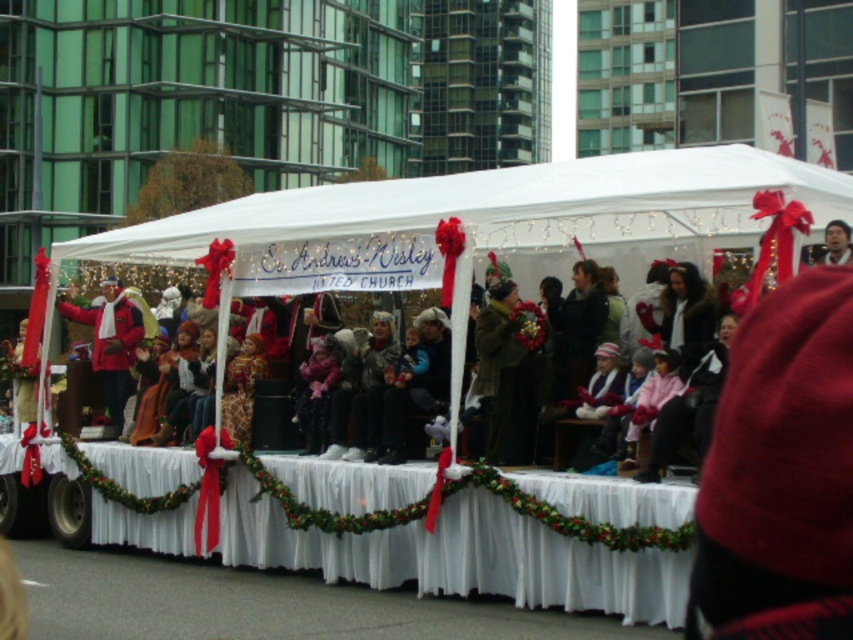
Is red wool coat at left thinner than smooth brown hair at upper right?

No.

Does red wool coat at left have a greater width compared to smooth brown hair at upper right?

Yes, red wool coat at left is wider than smooth brown hair at upper right.

Is point (96, 371) closer to camera compared to point (833, 227)?

No, it is behind (833, 227).

Identify the location of red wool coat at left. The image size is (853, 640). (111, 342).